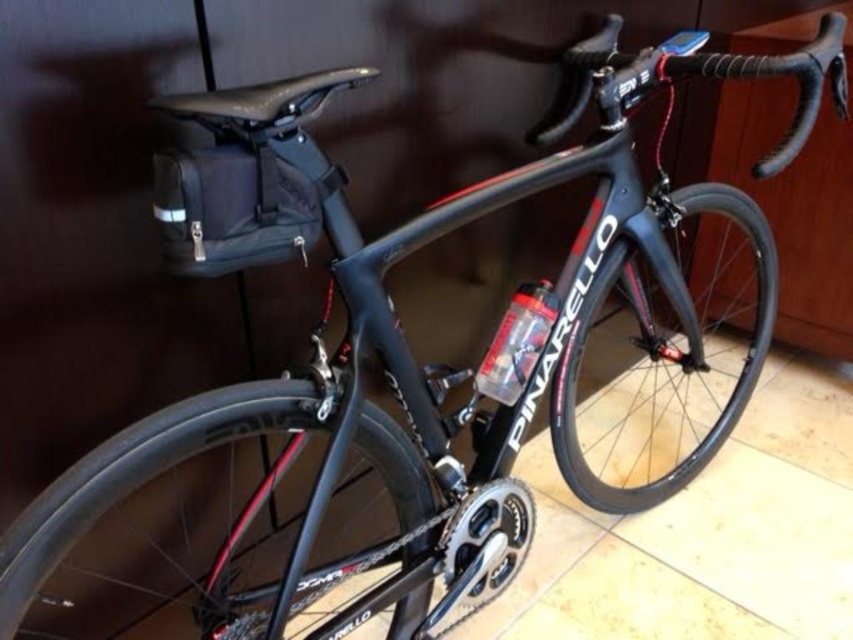
You are a cyclist examining the carbon fiber wheel at center and the shiny black rim at center of your new Pinarello road bicycle. Which component is closer to your face when you look directly at the bike?

The carbon fiber wheel at center is closer to your face because it is further to the viewer than the shiny black rim at center.

You are a mechanic checking the bike. You need to install a new brake pad. The brake pad is designed to fit rims with a diameter of 622mm. The carbon fiber wheel at center has a diameter of 622mm. Can the shiny black rim at center also use this brake pad?

The carbon fiber wheel at center is bigger than shiny black rim at center. Since the carbon fiber wheel at center has a diameter of 622mm, the shiny black rim at center must be smaller than 622mm. Therefore, the brake pad designed for 622mm rims will not fit the shiny black rim at center.